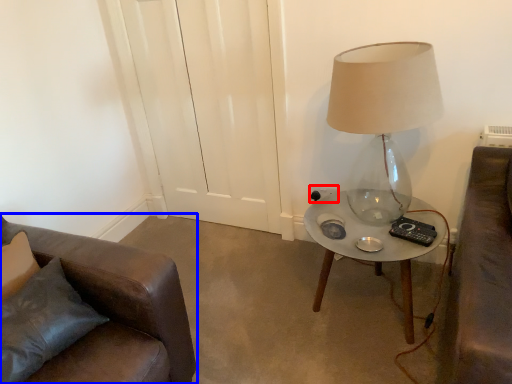
Question: Among these objects, which one is nearest to the camera, electric outlet (highlighted by a red box) or chair (highlighted by a blue box)?

Choices:
 (A) electric outlet
 (B) chair

Answer: (B)